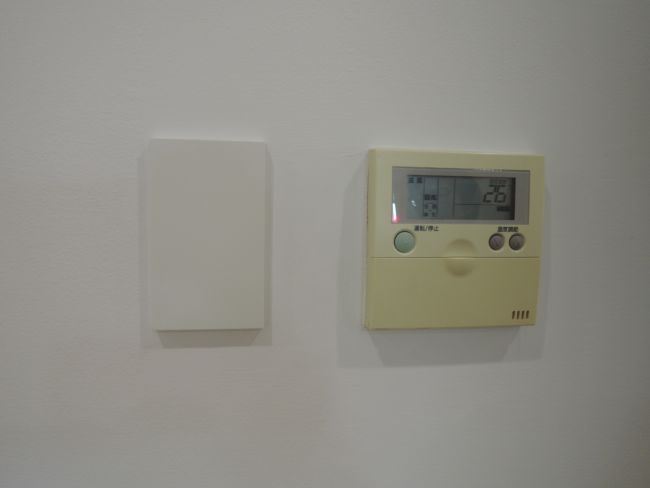
Locate an element on the screen. The height and width of the screenshot is (488, 650). lower area of thermostat is located at coordinates (450, 309).